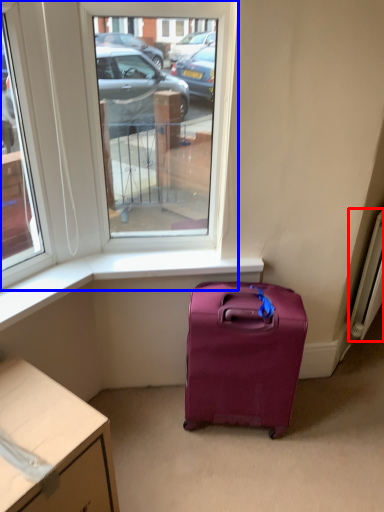
Question: Which object is further to the camera taking this photo, radiator (highlighted by a red box) or window (highlighted by a blue box)?

Choices:
 (A) radiator
 (B) window

Answer: (A)